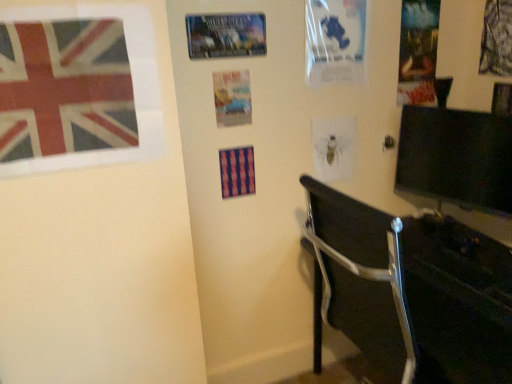
Question: Should I look upward or downward to see black glossy monitor at right?

Choices:
 (A) up
 (B) down

Answer: (A)

Question: Is black glossy monitor at right smaller than textured fabric poster at upper right, arranged as the first poster page when viewed from the right?

Choices:
 (A) no
 (B) yes

Answer: (A)

Question: From the image's perspective, does black glossy monitor at right appear higher than textured fabric poster at upper right, arranged as the first poster page when viewed from the right?

Choices:
 (A) no
 (B) yes

Answer: (A)

Question: Can you confirm if black glossy monitor at right is taller than textured fabric poster at upper right, arranged as the first poster page when viewed from the right?

Choices:
 (A) no
 (B) yes

Answer: (A)

Question: From a real-world perspective, is black glossy monitor at right over textured fabric poster at upper right, arranged as the sixth poster page when viewed from the left?

Choices:
 (A) yes
 (B) no

Answer: (B)

Question: Does black glossy monitor at right have a lesser height compared to textured fabric poster at upper right, arranged as the first poster page when viewed from the right?

Choices:
 (A) yes
 (B) no

Answer: (A)

Question: Is black glossy monitor at right not near textured fabric poster at upper right, arranged as the sixth poster page when viewed from the left?

Choices:
 (A) yes
 (B) no

Answer: (B)

Question: Is black glossy monitor at right located within printed fabric flag at upper left?

Choices:
 (A) no
 (B) yes

Answer: (A)

Question: Is printed fabric flag at upper left oriented away from black glossy monitor at right?

Choices:
 (A) yes
 (B) no

Answer: (B)

Question: Can you confirm if printed fabric flag at upper left is positioned to the right of black glossy monitor at right?

Choices:
 (A) yes
 (B) no

Answer: (B)

Question: Is printed fabric flag at upper left smaller than black glossy monitor at right?

Choices:
 (A) yes
 (B) no

Answer: (A)

Question: From a real-world perspective, is printed fabric flag at upper left positioned over black glossy monitor at right based on gravity?

Choices:
 (A) yes
 (B) no

Answer: (A)

Question: Is printed fabric flag at upper left wider than black glossy monitor at right?

Choices:
 (A) yes
 (B) no

Answer: (B)

Question: Can you confirm if printed fabric flag at upper left is taller than metallic silver poster at upper center, marked as the first poster page in a left-to-right arrangement?

Choices:
 (A) yes
 (B) no

Answer: (A)